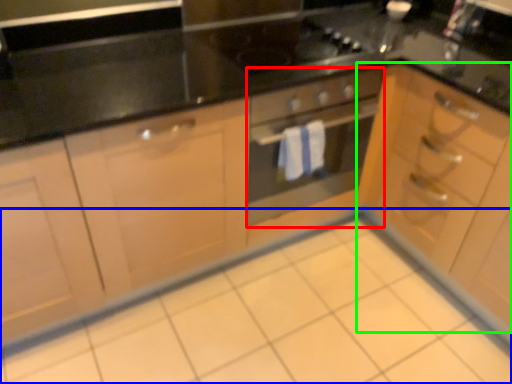
Question: Which object is the farthest from oven (highlighted by a red box)? Choose among these: ceramic tile (highlighted by a blue box) or cabinetry (highlighted by a green box).

Choices:
 (A) ceramic tile
 (B) cabinetry

Answer: (A)